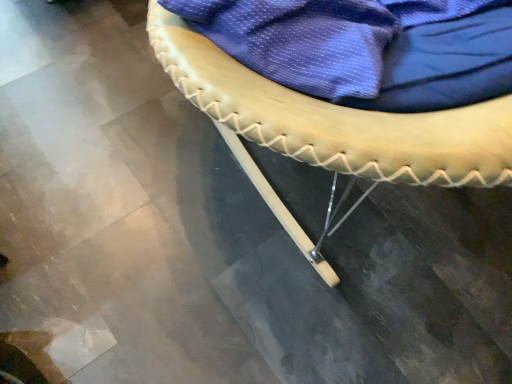
The height and width of the screenshot is (384, 512). What do you see at coordinates (331, 127) in the screenshot?
I see `leather-like beige chair at upper center` at bounding box center [331, 127].

Find the location of a particular element. This screenshot has height=384, width=512. leather-like beige chair at upper center is located at coordinates (331, 127).

The width and height of the screenshot is (512, 384). Identify the location of leather-like beige chair at upper center. (331, 127).